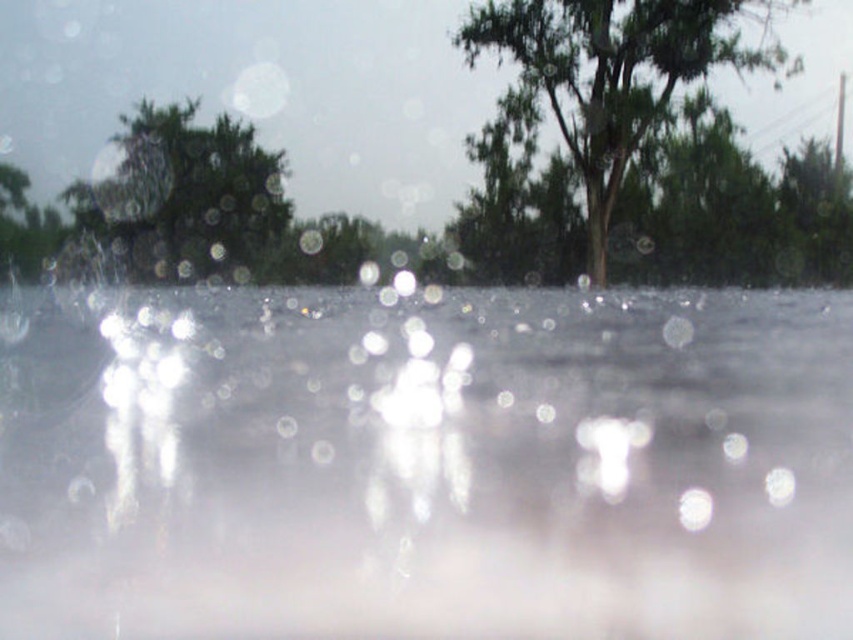
You are standing on the wet surface and want to avoid stepping on the transparent water at center. Which direction should you move to stay under the green matte tree at upper left?

To stay under the green matte tree at upper left while avoiding the transparent water at center, move towards the upper left direction, away from the center area where the water is located.

You are a photographer aiming to capture the reflection of the transparent water at center without the green matte tree at upper left appearing in the shot. Is this possible based on their positions?

The transparent water at center is in front of the green matte tree at upper left, so adjusting the camera angle to focus on the water while avoiding the tree in the frame would allow capturing the reflection without the tree appearing.

You are standing at the point with coordinates point (x=613, y=76). What object is located exactly at your current position?

The green leafy tree at upper center is located exactly at point (x=613, y=76).